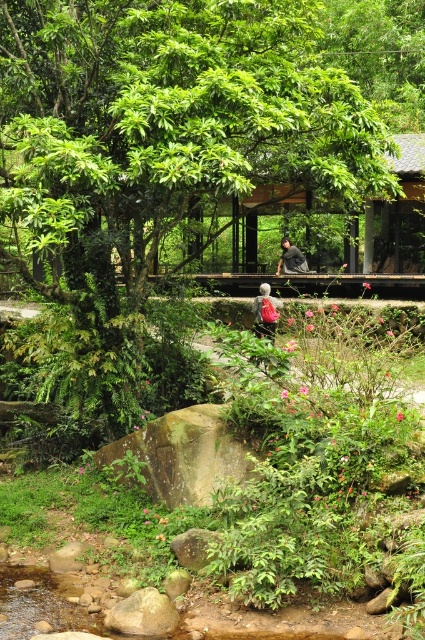
You are standing in the garden and want to place a 10 feet long bench between the green leafy tree at center and the dark gray fabric jacket at center. Is there enough space for the bench?

The green leafy tree at center is 31.67 feet from the dark gray fabric jacket at center, so yes, there is enough space to place a 10 feet long bench between them since the distance is greater than the bench length.

You are in a garden and want to place a small birdhouse between the green leafy tree at center and the green leafy bush at center. Which object should the birdhouse be closer to if it needs to be near the smaller one?

The green leafy tree at center is smaller than the green leafy bush at center, so the birdhouse should be placed closer to the green leafy tree at center.